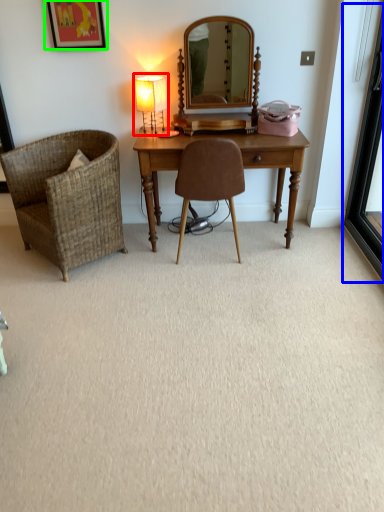
Question: Which is farther away from table lamp (highlighted by a red box)? screen door (highlighted by a blue box) or picture frame (highlighted by a green box)?

Choices:
 (A) screen door
 (B) picture frame

Answer: (A)